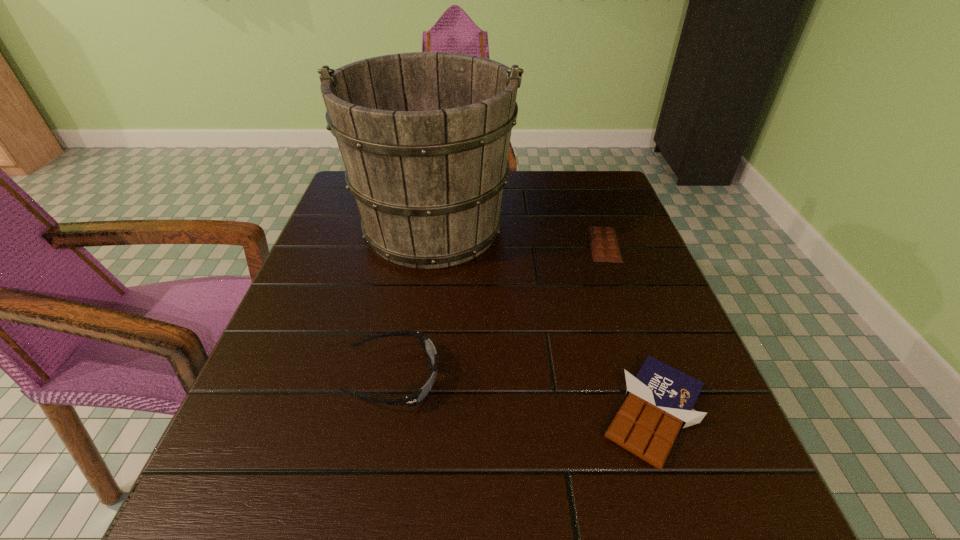
Image resolution: width=960 pixels, height=540 pixels. What are the coordinates of `empty space between the nearer chocolate bar and the tallest object` in the screenshot? It's located at (543, 319).

What are the coordinates of `empty space that is in between the farther chocolate bar and the bucket` in the screenshot? It's located at (519, 235).

Locate an element on the screen. The width and height of the screenshot is (960, 540). free space between the third shortest object and the shorter chocolate bar is located at coordinates (499, 312).

This screenshot has width=960, height=540. What are the coordinates of `free area in between the tallest object and the third tallest object` in the screenshot? It's located at (543, 319).

Locate an element on the screen. This screenshot has width=960, height=540. unoccupied position between the tallest object and the shorter chocolate bar is located at coordinates (519, 235).

Locate an element on the screen. vacant area that lies between the second tallest object and the third tallest object is located at coordinates (524, 395).

At what (x,y) coordinates should I click in order to perform the action: click on vacant space that is in between the taller chocolate bar and the bucket. Please return your answer as a coordinate pair (x, y). This screenshot has width=960, height=540. Looking at the image, I should click on (543, 319).

Find the location of `vacant space that is in between the nearer chocolate bar and the third shortest object`. vacant space that is in between the nearer chocolate bar and the third shortest object is located at coordinates (524, 395).

What are the coordinates of `free point between the third tallest object and the third shortest object` in the screenshot? It's located at (524, 395).

This screenshot has width=960, height=540. I want to click on object identified as the third closest to the tallest object, so click(x=660, y=399).